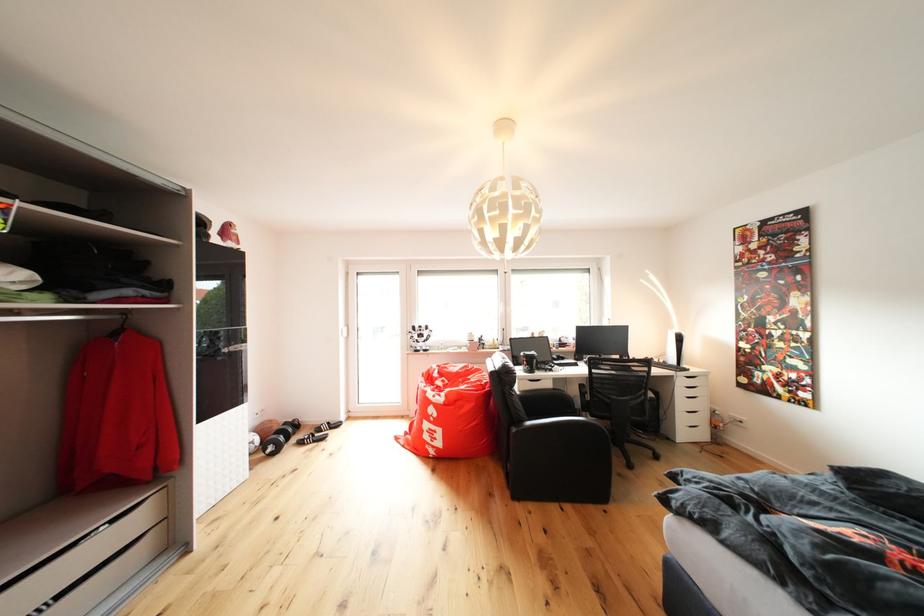
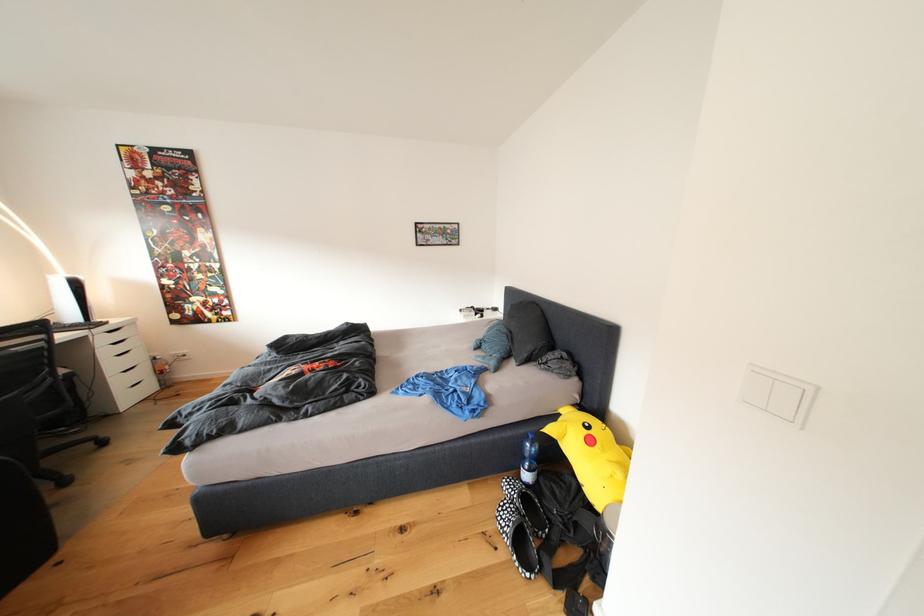
Question: Based on the continuous images, in which direction is the camera rotating? Reply with the corresponding letter.

Choices:
 (A) Left
 (B) Right
 (C) Up
 (D) Down

Answer: (B)